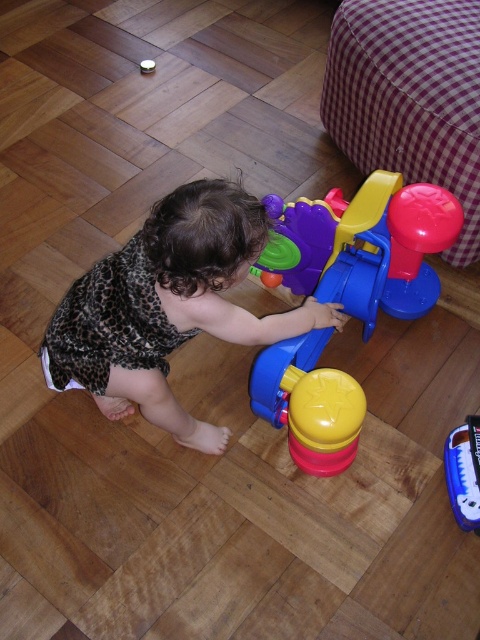
You are a photographer setting up for a shoot. You want to capture the leopard print dress at center and the blue plastic toy at center in the same frame. Based on their positions, which object should you focus on first to ensure both are in focus?

The leopard print dress at center is closer to the viewer than the blue plastic toy at center, so focusing on the leopard print dress at center first will help ensure both are in focus since it is the closer object.

You are a photographer trying to capture the child and the toy in the image. If you want to position the leopard print dress at center and the rubberized plastic toy at center so that the dress is on the left side of the frame, is the current arrangement suitable?

Yes, the current arrangement is suitable because the leopard print dress at center is already positioned to the left of the rubberized plastic toy at center, aligning with your desired setup.